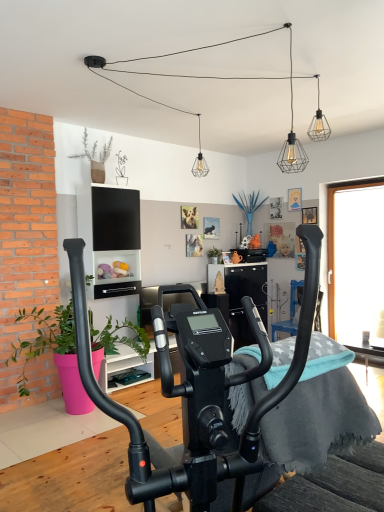
Question: Is blue fabric armchair at center oriented away from green matte plant at left, the 1th plant from the front?

Choices:
 (A) no
 (B) yes

Answer: (A)

Question: From the image's perspective, does blue fabric armchair at center appear lower than green matte plant at left, the 1th plant from the front?

Choices:
 (A) yes
 (B) no

Answer: (B)

Question: Could you tell me if blue fabric armchair at center is facing green matte plant at left, the 2th plant in the right-to-left sequence?

Choices:
 (A) yes
 (B) no

Answer: (A)

Question: From a real-world perspective, is blue fabric armchair at center located higher than green matte plant at left, the second plant viewed from the back?

Choices:
 (A) yes
 (B) no

Answer: (B)

Question: From a real-world perspective, is blue fabric armchair at center beneath green matte plant at left, positioned as the 1th plant in bottom-to-top order?

Choices:
 (A) yes
 (B) no

Answer: (A)

Question: Is point (291, 289) closer or farther from the camera than point (39, 338)?

Choices:
 (A) closer
 (B) farther

Answer: (A)

Question: Do you think blue fabric armchair at center is within green matte plant at left, the 2th plant in the right-to-left sequence, or outside of it?

Choices:
 (A) outside
 (B) inside

Answer: (A)

Question: Considering the positions of blue fabric armchair at center and green matte plant at left, positioned as the 1th plant in bottom-to-top order, in the image, is blue fabric armchair at center wider or thinner than green matte plant at left, positioned as the 1th plant in bottom-to-top order,?

Choices:
 (A) wide
 (B) thin

Answer: (B)

Question: From the image's perspective, is blue fabric armchair at center located above or below green matte plant at left, arranged as the second plant when viewed from the top?

Choices:
 (A) below
 (B) above

Answer: (B)

Question: From their relative heights in the image, would you say metal wire cage at upper center is taller or shorter than green matte plant at center, the 1th plant when ordered from right to left?

Choices:
 (A) short
 (B) tall

Answer: (B)

Question: Do you think metal wire cage at upper center is within green matte plant at center, which ranks as the 1th plant in top-to-bottom order, or outside of it?

Choices:
 (A) inside
 (B) outside

Answer: (B)

Question: Considering the positions of metal wire cage at upper center and green matte plant at center, marked as the 2th plant in a bottom-to-top arrangement, in the image, is metal wire cage at upper center bigger or smaller than green matte plant at center, marked as the 2th plant in a bottom-to-top arrangement,?

Choices:
 (A) big
 (B) small

Answer: (A)

Question: Is metal wire cage at upper center in front of or behind green matte plant at center, the 1th plant when ordered from right to left, in the image?

Choices:
 (A) front
 (B) behind

Answer: (A)

Question: Considering the positions of wooden table at lower right and black matte stationary bicycle at center in the image, is wooden table at lower right wider or thinner than black matte stationary bicycle at center?

Choices:
 (A) thin
 (B) wide

Answer: (A)

Question: In the image, is wooden table at lower right positioned in front of or behind black matte stationary bicycle at center?

Choices:
 (A) behind
 (B) front

Answer: (A)